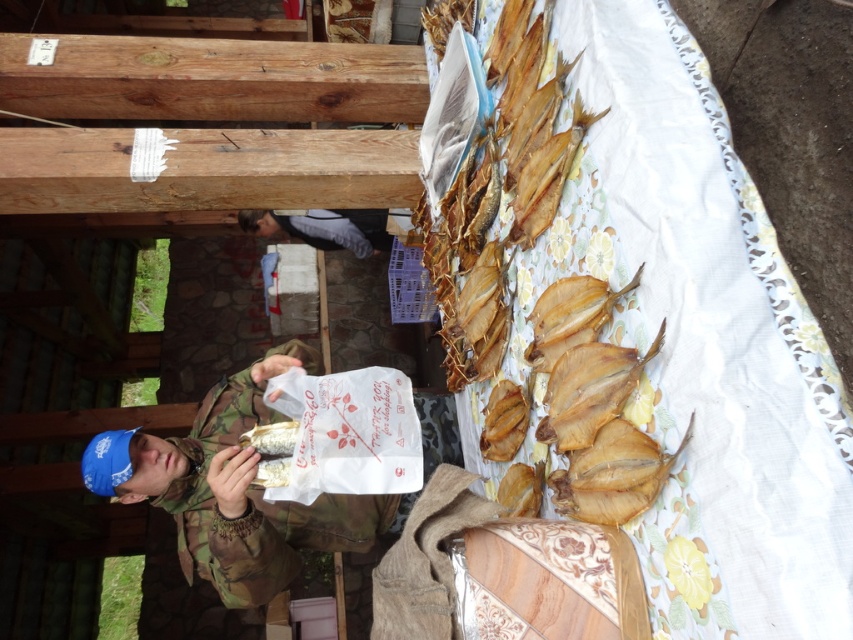
You are a customer at the market and want to buy the dried fish. You see the camouflage jacket at center and the gray fabric at center. Which item is closer to the right side of the market stall?

The camouflage jacket at center is closer to the right side of the market stall because it is positioned to the right of the gray fabric at center.

You are standing at the entrance of the outdoor market. You see a point marked at coordinates (233, 490). What object is located at that point?

The point at coordinates (233, 490) marks the camouflage jacket at center.